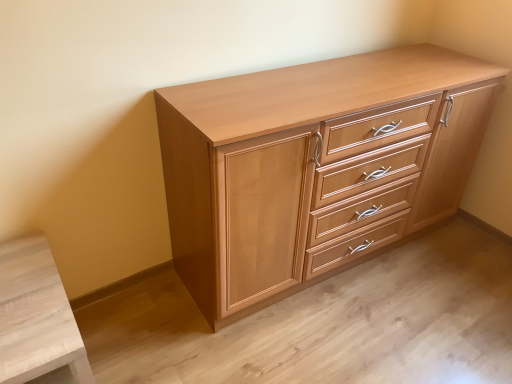
What do you see at coordinates (314, 167) in the screenshot? The image size is (512, 384). I see `light brown wood chest of drawers at center` at bounding box center [314, 167].

This screenshot has height=384, width=512. In order to click on light brown wood chest of drawers at center in this screenshot , I will do `click(314, 167)`.

What do you see at coordinates (36, 316) in the screenshot? I see `light wood cabinet at lower left` at bounding box center [36, 316].

Image resolution: width=512 pixels, height=384 pixels. I want to click on light wood cabinet at lower left, so click(x=36, y=316).

Locate an element on the screen. This screenshot has height=384, width=512. light brown wood chest of drawers at center is located at coordinates click(314, 167).

Based on the photo, does light brown wood chest of drawers at center appear on the right side of light wood cabinet at lower left?

Indeed, light brown wood chest of drawers at center is positioned on the right side of light wood cabinet at lower left.

Is light brown wood chest of drawers at center behind light wood cabinet at lower left?

Yes, the depth of light brown wood chest of drawers at center is greater than that of light wood cabinet at lower left.

Which is in front, point (179, 182) or point (19, 294)?

The point (19, 294) is closer.

From the image's perspective, which object appears higher, light brown wood chest of drawers at center or light wood cabinet at lower left?

light brown wood chest of drawers at center appears higher in the image.

From a real-world perspective, who is located lower, light brown wood chest of drawers at center or light wood cabinet at lower left?

light wood cabinet at lower left, from a real-world perspective.

In terms of width, does light brown wood chest of drawers at center look wider or thinner when compared to light wood cabinet at lower left?

Clearly, light brown wood chest of drawers at center has less width compared to light wood cabinet at lower left.

Considering the sizes of objects light brown wood chest of drawers at center and light wood cabinet at lower left in the image provided, who is shorter, light brown wood chest of drawers at center or light wood cabinet at lower left?

light wood cabinet at lower left is shorter.

In the scene shown: Can you confirm if light brown wood chest of drawers at center is smaller than light wood cabinet at lower left?

No.

Is light brown wood chest of drawers at center positioned beyond the bounds of light wood cabinet at lower left?

Yes, light brown wood chest of drawers at center is not within light wood cabinet at lower left.

Can you see light brown wood chest of drawers at center touching light wood cabinet at lower left?

light brown wood chest of drawers at center and light wood cabinet at lower left are not in contact.

Could you tell me if light brown wood chest of drawers at center is facing light wood cabinet at lower left?

No, light brown wood chest of drawers at center is not oriented towards light wood cabinet at lower left.

Can you tell me how much light brown wood chest of drawers at center and light wood cabinet at lower left differ in facing direction?

light brown wood chest of drawers at center and light wood cabinet at lower left are facing 0.239 degrees away from each other.

The width and height of the screenshot is (512, 384). Identify the location of vanity below the light brown wood chest of drawers at center (from the image's perspective). (36, 316).

Would you say light wood cabinet at lower left is to the left or to the right of light brown wood chest of drawers at center in the picture?

light wood cabinet at lower left is to the left of light brown wood chest of drawers at center.

Is light wood cabinet at lower left further to the viewer compared to light brown wood chest of drawers at center?

No, light wood cabinet at lower left is closer to the camera.

Does point (72, 350) come in front of point (197, 269)?

That is True.

From the image's perspective, which one is positioned lower, light wood cabinet at lower left or light brown wood chest of drawers at center?

light wood cabinet at lower left, from the image's perspective.

From a real-world perspective, who is located higher, light wood cabinet at lower left or light brown wood chest of drawers at center?

light brown wood chest of drawers at center.

Considering the sizes of light wood cabinet at lower left and light brown wood chest of drawers at center in the image, is light wood cabinet at lower left wider or thinner than light brown wood chest of drawers at center?

Clearly, light wood cabinet at lower left has more width compared to light brown wood chest of drawers at center.

Considering the relative sizes of light wood cabinet at lower left and light brown wood chest of drawers at center in the image provided, is light wood cabinet at lower left shorter than light brown wood chest of drawers at center?

Indeed, light wood cabinet at lower left has a lesser height compared to light brown wood chest of drawers at center.

Is light wood cabinet at lower left bigger than light brown wood chest of drawers at center?

Actually, light wood cabinet at lower left might be smaller than light brown wood chest of drawers at center.

Does light wood cabinet at lower left contain light brown wood chest of drawers at center?

That's incorrect, light brown wood chest of drawers at center is not inside light wood cabinet at lower left.

Looking at this image, would you consider light wood cabinet at lower left to be distant from light brown wood chest of drawers at center?

No, light wood cabinet at lower left is not far from light brown wood chest of drawers at center.

Is light wood cabinet at lower left aimed at light brown wood chest of drawers at center?

No, light wood cabinet at lower left is not aimed at light brown wood chest of drawers at center.

How many degrees apart are the facing directions of light wood cabinet at lower left and light brown wood chest of drawers at center?

0.239 degrees.

The height and width of the screenshot is (384, 512). What are the coordinates of `vanity below the light brown wood chest of drawers at center (from a real-world perspective)` in the screenshot? It's located at (36, 316).

Locate an element on the screen. the chest of drawers located above the light wood cabinet at lower left (from the image's perspective) is located at coordinates (314, 167).

Locate an element on the screen. the chest of drawers above the light wood cabinet at lower left (from a real-world perspective) is located at coordinates (314, 167).